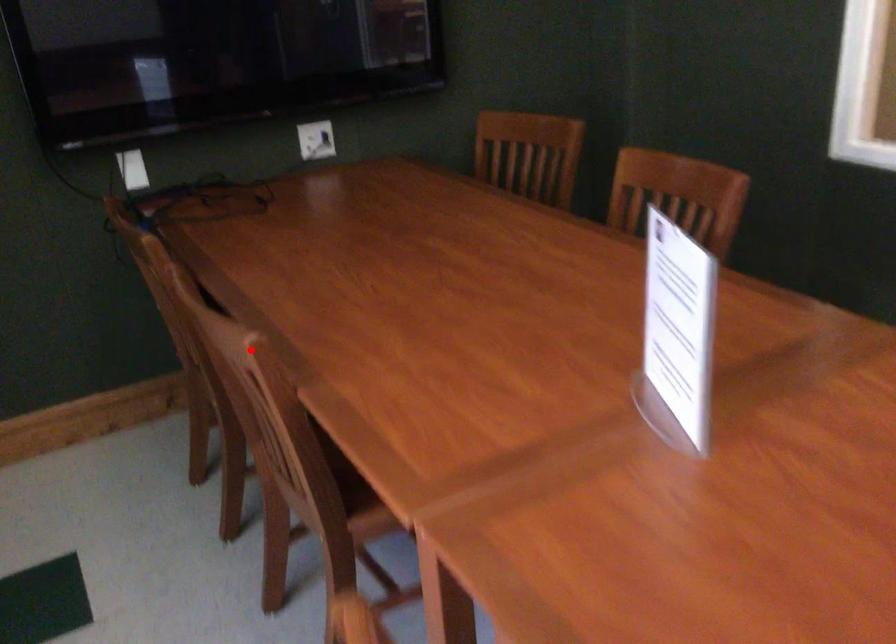
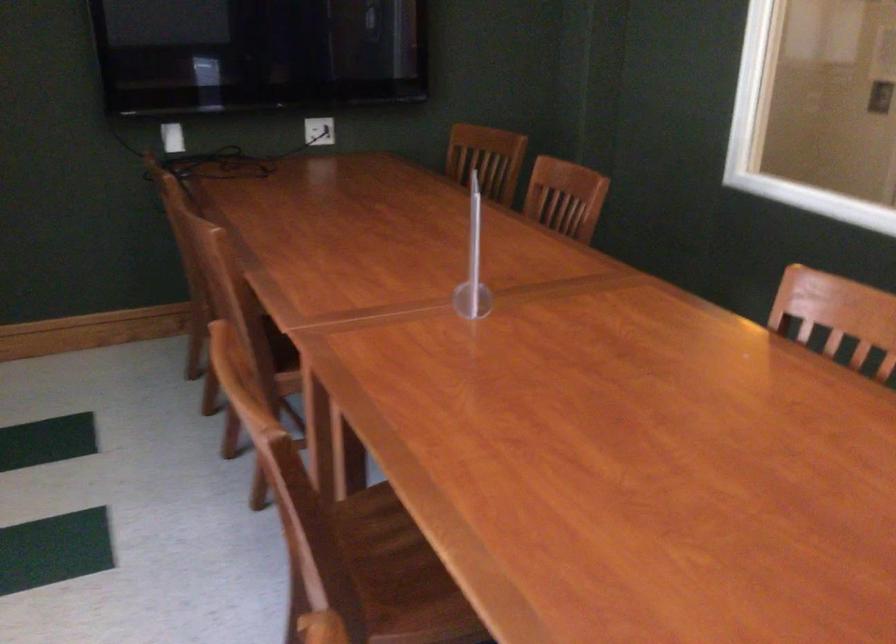
Locate, in the second image, the point that corresponds to the highlighted location in the first image.

(216, 242)